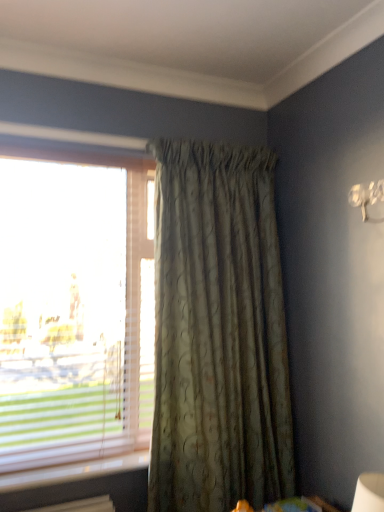
Question: From a real-world perspective, is green textured curtain at center physically located above or below translucent glass window at left?

Choices:
 (A) above
 (B) below

Answer: (B)

Question: Is point (215, 146) positioned closer to the camera than point (94, 236)?

Choices:
 (A) closer
 (B) farther

Answer: (B)

Question: In terms of height, does green textured curtain at center look taller or shorter compared to translucent glass window at left?

Choices:
 (A) tall
 (B) short

Answer: (A)

Question: From a real-world perspective, is translucent glass window at left above or below green textured curtain at center?

Choices:
 (A) below
 (B) above

Answer: (B)

Question: Based on their sizes in the image, would you say translucent glass window at left is bigger or smaller than green textured curtain at center?

Choices:
 (A) big
 (B) small

Answer: (B)

Question: Is point (21, 210) positioned closer to the camera than point (264, 431)?

Choices:
 (A) farther
 (B) closer

Answer: (B)

Question: From the image's perspective, is translucent glass window at left located above or below green textured curtain at center?

Choices:
 (A) above
 (B) below

Answer: (A)